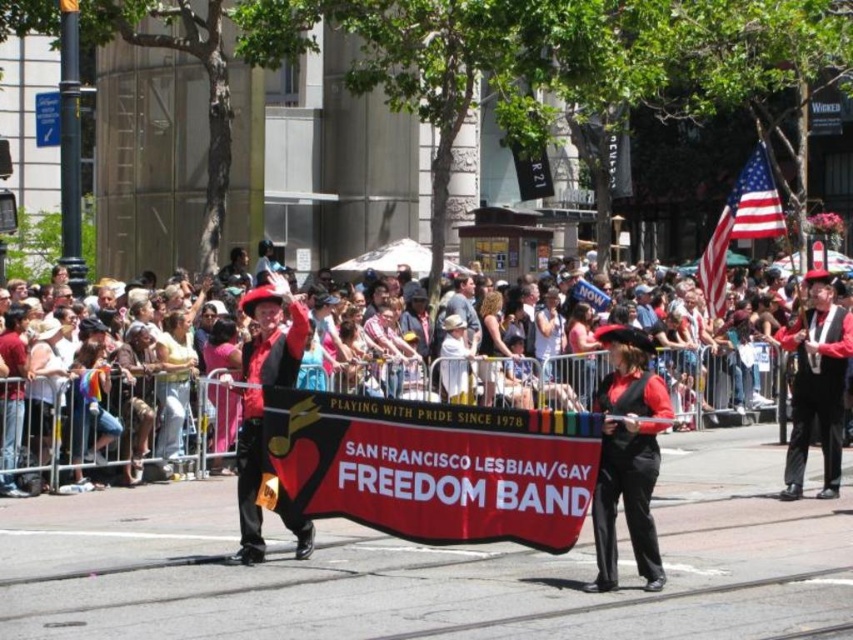
What are the coordinates of the matte black banner at center?

The coordinates of the matte black banner at center are point (112, 419).

You are a photographer at the parade and want to capture both the matte black banner at center and the matte red hat at center in a single shot. Given their sizes, which object should you focus on to ensure both are clearly visible in the frame?

The matte black banner at center is bigger than the matte red hat at center, so focusing on the matte black banner at center will help ensure both objects are clearly visible in the frame since it takes up more space and can be positioned to include the smaller matte red hat at center.